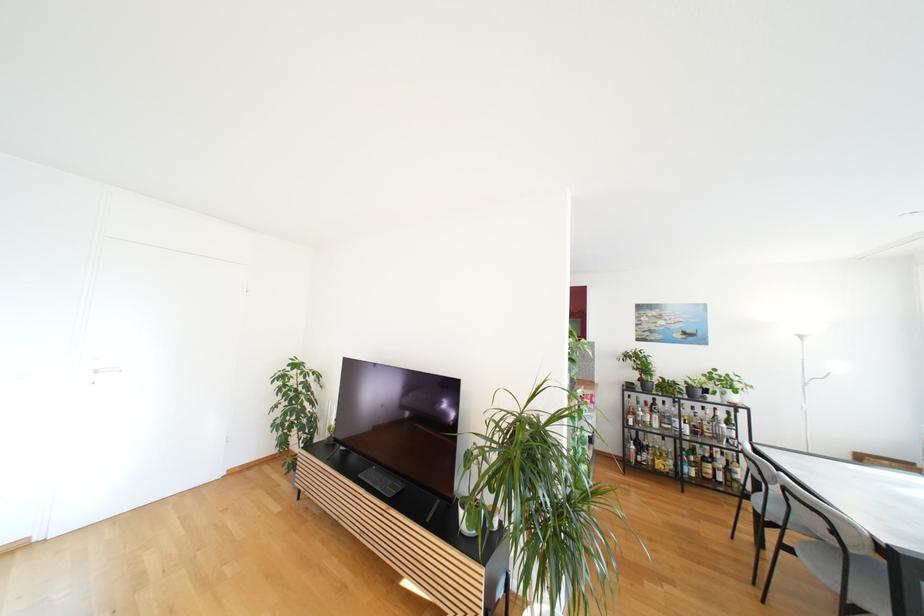
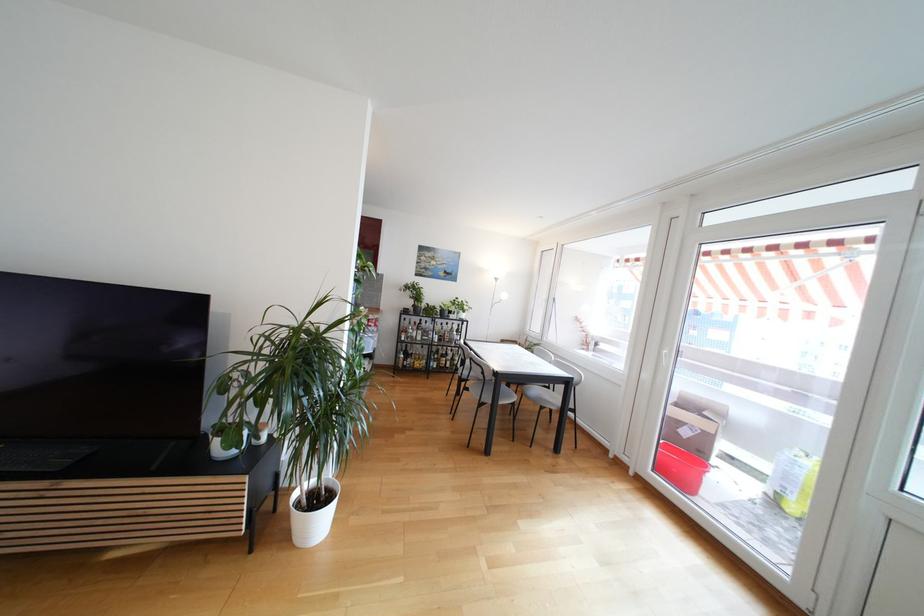
Locate, in the second image, the point that corresponds to the point at 715,439 in the first image.

(453, 342)